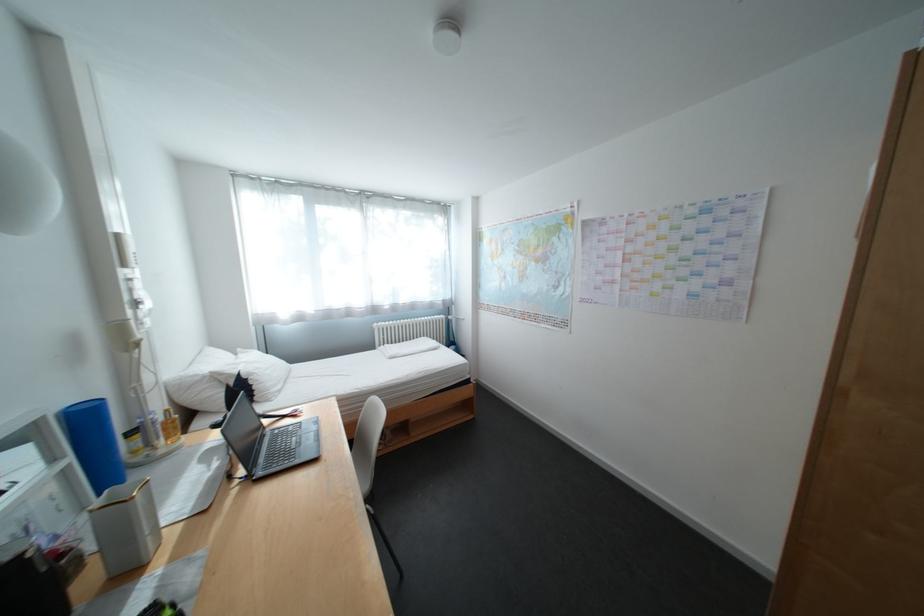
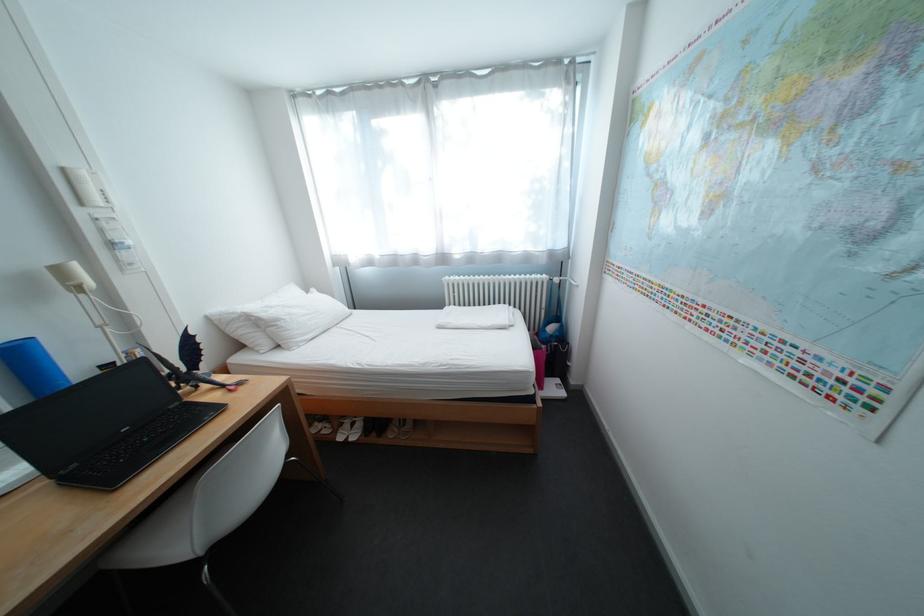
Find the pixel in the second image that matches (x=129, y=237) in the first image.

(76, 171)